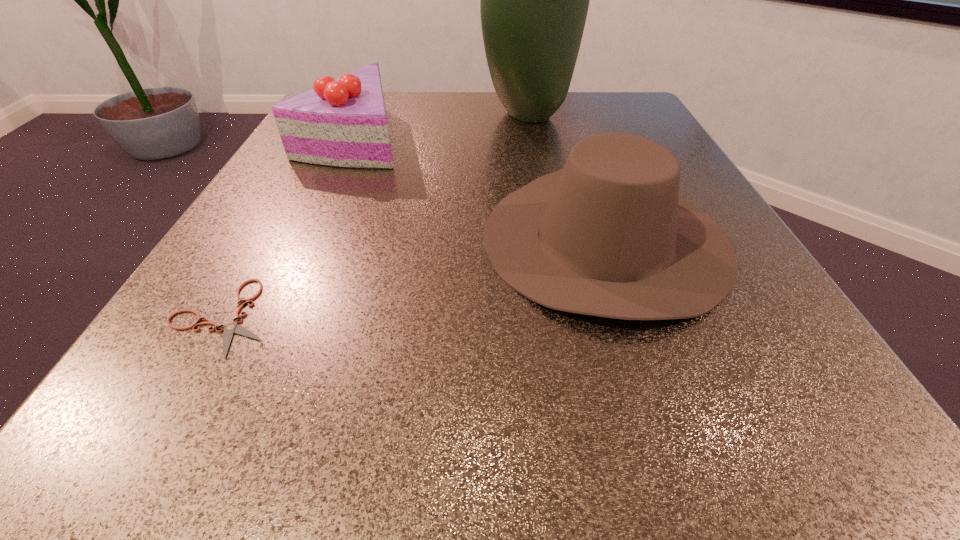
The image size is (960, 540). I want to click on vacant position in the image that satisfies the following two spatial constraints: 1. on the back side of the cowboy hat; 2. on the right side of the shortest object, so click(267, 239).

This screenshot has width=960, height=540. Find the location of `free space that satisfies the following two spatial constraints: 1. on the back side of the cowboy hat; 2. on the left side of the shortest object`. free space that satisfies the following two spatial constraints: 1. on the back side of the cowboy hat; 2. on the left side of the shortest object is located at coordinates coord(267,239).